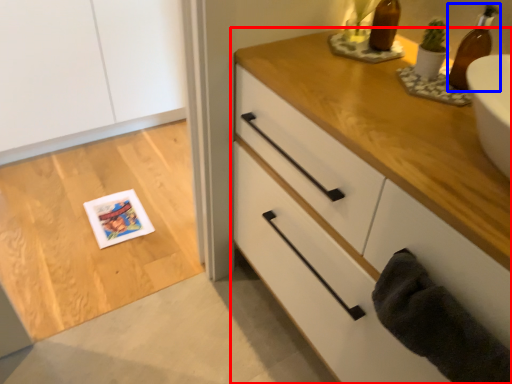
Question: Among these objects, which one is farthest to the camera, chest of drawers (highlighted by a red box) or beer bottle (highlighted by a blue box)?

Choices:
 (A) chest of drawers
 (B) beer bottle

Answer: (B)